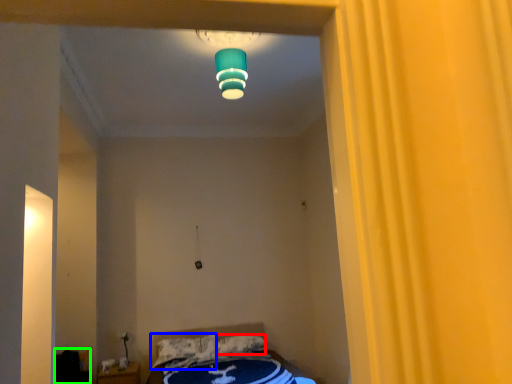
Question: Which object is the farthest from pillow (highlighted by a red box)? Choose among these: pillow (highlighted by a blue box) or furniture (highlighted by a green box).

Choices:
 (A) pillow
 (B) furniture

Answer: (B)